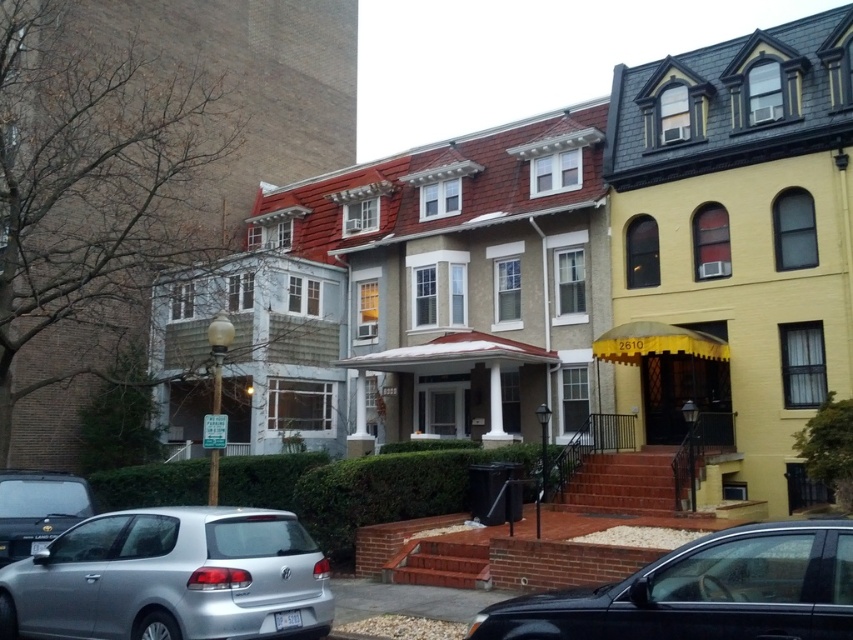
Between silver metallic hatchback at lower left and matte black car at lower left, which one is positioned lower?

silver metallic hatchback at lower left is lower down.

Does silver metallic hatchback at lower left lie behind matte black car at lower left?

No, silver metallic hatchback at lower left is in front of matte black car at lower left.

Is point (13, 600) positioned after point (65, 509)?

No, (13, 600) is closer to viewer.

This screenshot has width=853, height=640. What are the coordinates of `silver metallic hatchback at lower left` in the screenshot? It's located at tap(172, 579).

Is point (242, 611) less distant than point (695, 625)?

No.

Is silver metallic hatchback at lower left taller than shiny black sedan at lower center?

Yes, silver metallic hatchback at lower left is taller than shiny black sedan at lower center.

Which is in front, point (126, 572) or point (651, 620)?

Point (651, 620) is more forward.

Where is `silver metallic hatchback at lower left`? The image size is (853, 640). silver metallic hatchback at lower left is located at coordinates (172, 579).

Can you confirm if shiny black sedan at lower center is bigger than matte black car at lower left?

Indeed, shiny black sedan at lower center has a larger size compared to matte black car at lower left.

Is shiny black sedan at lower center to the left of matte black car at lower left from the viewer's perspective?

In fact, shiny black sedan at lower center is to the right of matte black car at lower left.

Image resolution: width=853 pixels, height=640 pixels. Describe the element at coordinates (703, 592) in the screenshot. I see `shiny black sedan at lower center` at that location.

Locate an element on the screen. shiny black sedan at lower center is located at coordinates (703, 592).